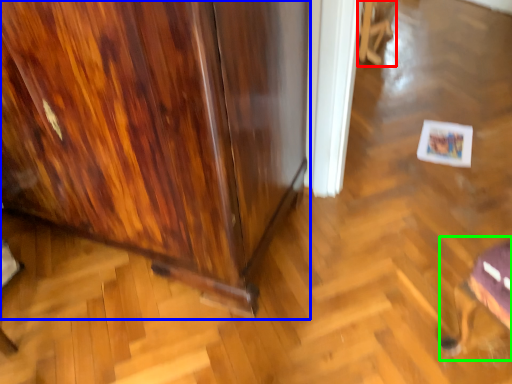
Question: Estimate the real-world distances between objects in this image. Which object is farther from swivel chair (highlighted by a red box), furniture (highlighted by a blue box) or swivel chair (highlighted by a green box)?

Choices:
 (A) furniture
 (B) swivel chair

Answer: (B)